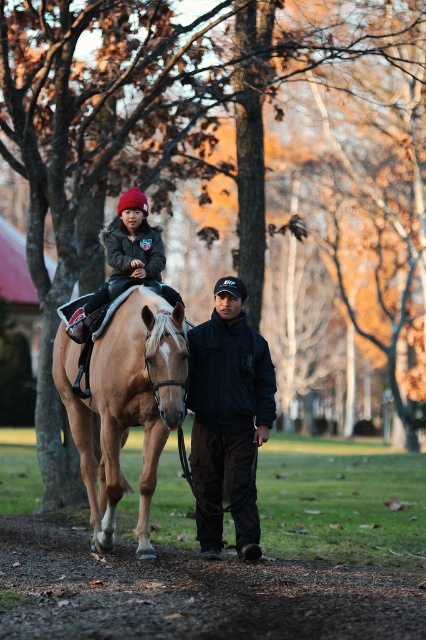
Is black matte jacket at center in front of dark gray fleece jacket at upper left?

No, black matte jacket at center is further to the viewer.

Is point (213, 385) more distant than point (134, 230)?

No, it is not.

This screenshot has width=426, height=640. Find the location of `black matte jacket at center`. black matte jacket at center is located at coordinates (227, 419).

Who is more distant from viewer, (118, 316) or (140, 244)?

The point (140, 244) is more distant.

Is light brown leather horse at center shorter than dark gray fleece jacket at upper left?

No, light brown leather horse at center is not shorter than dark gray fleece jacket at upper left.

Between point (149, 500) and point (152, 266), which one is positioned behind?

Point (152, 266)

Where is `light brown leather horse at center`? The image size is (426, 640). light brown leather horse at center is located at coordinates (124, 404).

Between light brown leather horse at center and black matte jacket at center, which one is positioned higher?

Positioned higher is black matte jacket at center.

Is point (103, 541) positioned behind point (252, 428)?

No, (103, 541) is closer to viewer.

This screenshot has height=640, width=426. I want to click on light brown leather horse at center, so click(x=124, y=404).